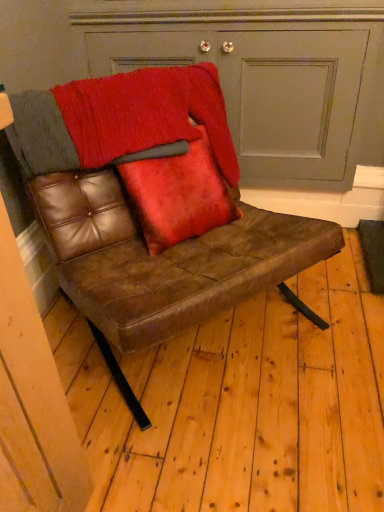
Question: Can you confirm if velvet red pillow at center is thinner than matte gray door at upper center?

Choices:
 (A) yes
 (B) no

Answer: (A)

Question: Considering the relative positions of velvet red pillow at center and matte gray door at upper center in the image provided, is velvet red pillow at center to the right of matte gray door at upper center from the viewer's perspective?

Choices:
 (A) yes
 (B) no

Answer: (B)

Question: Is velvet red pillow at center behind matte gray door at upper center?

Choices:
 (A) yes
 (B) no

Answer: (B)

Question: Is the surface of velvet red pillow at center in direct contact with matte gray door at upper center?

Choices:
 (A) yes
 (B) no

Answer: (B)

Question: Does velvet red pillow at center have a smaller size compared to matte gray door at upper center?

Choices:
 (A) yes
 (B) no

Answer: (A)

Question: Is brown leather chair at center inside the boundaries of textured wool blanket at upper center, or outside?

Choices:
 (A) outside
 (B) inside

Answer: (A)

Question: In terms of size, does brown leather chair at center appear bigger or smaller than textured wool blanket at upper center?

Choices:
 (A) small
 (B) big

Answer: (B)

Question: In the image, is brown leather chair at center positioned in front of or behind textured wool blanket at upper center?

Choices:
 (A) behind
 (B) front

Answer: (B)

Question: In terms of height, does brown leather chair at center look taller or shorter compared to textured wool blanket at upper center?

Choices:
 (A) short
 (B) tall

Answer: (B)

Question: Is matte gray door at upper center wider or thinner than velvet red pillow at center?

Choices:
 (A) thin
 (B) wide

Answer: (B)

Question: From the image's perspective, is matte gray door at upper center located above or below velvet red pillow at center?

Choices:
 (A) above
 (B) below

Answer: (A)

Question: Is matte gray door at upper center bigger or smaller than velvet red pillow at center?

Choices:
 (A) small
 (B) big

Answer: (B)

Question: Considering their positions, is matte gray door at upper center located in front of or behind velvet red pillow at center?

Choices:
 (A) front
 (B) behind

Answer: (B)

Question: In terms of size, does matte gray door at upper center appear bigger or smaller than brown leather chair at center?

Choices:
 (A) big
 (B) small

Answer: (A)

Question: Relative to brown leather chair at center, is matte gray door at upper center in front or behind?

Choices:
 (A) front
 (B) behind

Answer: (B)